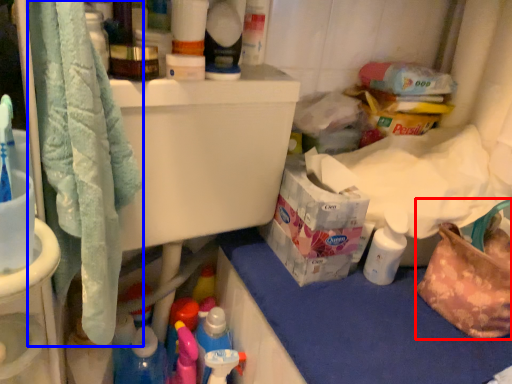
Question: Which of the following is the farthest to the observer, handbag (highlighted by a red box) or bath towel (highlighted by a blue box)?

Choices:
 (A) handbag
 (B) bath towel

Answer: (A)